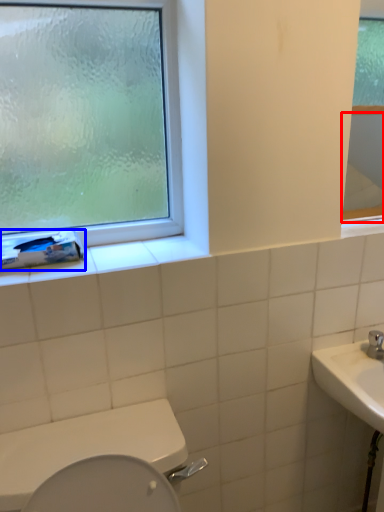
Question: Which point is further to the camera, mirror (highlighted by a red box) or toilet paper (highlighted by a blue box)?

Choices:
 (A) mirror
 (B) toilet paper

Answer: (A)